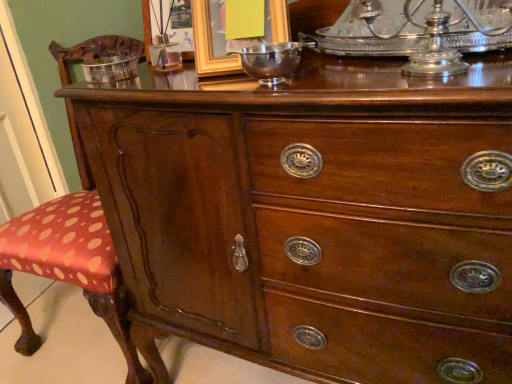
At what (x,y) coordinates should I click in order to perform the action: click on free area in between gold metallic picture frame at upper center, arranged as the 1th picture frame when viewed from the right, and shiny silver bowl at center. Please return your answer as a coordinate pair (x, y). The image size is (512, 384). Looking at the image, I should click on (234, 80).